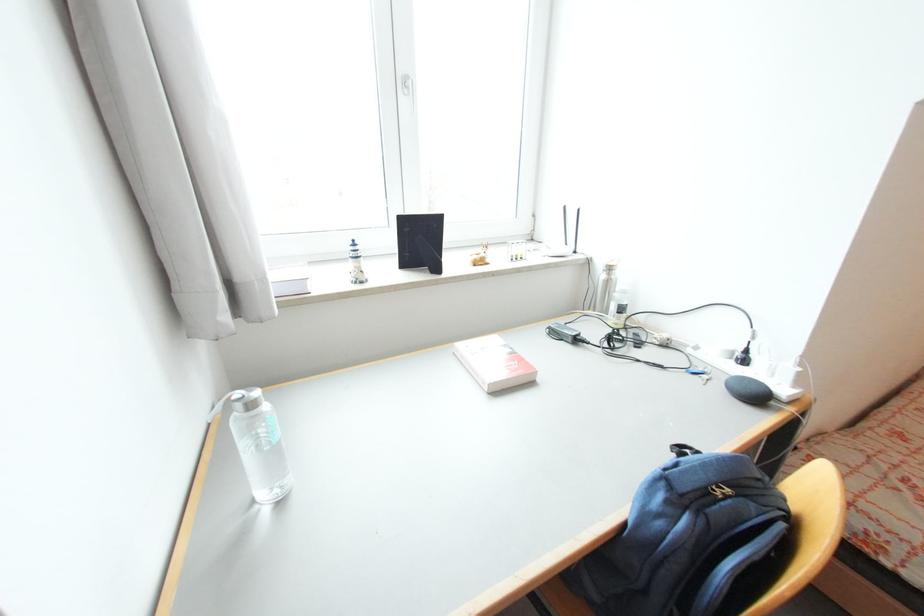
Locate an element on the screen. This screenshot has height=616, width=924. backpack top handle is located at coordinates (683, 450).